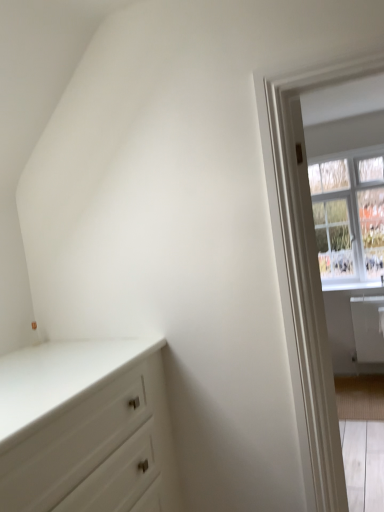
The height and width of the screenshot is (512, 384). Identify the location of white glossy chest of drawers at lower left. (86, 428).

At what (x,y) coordinates should I click in order to perform the action: click on clear glass window at upper right. Please return your answer as a coordinate pair (x, y). Looking at the image, I should click on (349, 216).

This screenshot has width=384, height=512. What do you see at coordinates (351, 286) in the screenshot?
I see `white glossy window sill at right` at bounding box center [351, 286].

Image resolution: width=384 pixels, height=512 pixels. I want to click on white glossy chest of drawers at lower left, so click(x=86, y=428).

Looking at this image, considering the sizes of objects clear glass window at upper right and white glossy window sill at right in the image provided, who is bigger, clear glass window at upper right or white glossy window sill at right?

Bigger between the two is clear glass window at upper right.

Consider the image. Considering the relative positions of clear glass window at upper right and white glossy window sill at right in the image provided, is clear glass window at upper right to the left or to the right of white glossy window sill at right?

From the image, it's evident that clear glass window at upper right is to the left of white glossy window sill at right.

Is clear glass window at upper right inside the boundaries of white glossy window sill at right, or outside?

clear glass window at upper right is not enclosed by white glossy window sill at right.

Which is in front, clear glass window at upper right or white glossy window sill at right?

clear glass window at upper right is in front.

From the picture: Which of these two, white glossy chest of drawers at lower left or white wooden door at right, is smaller?

With smaller size is white wooden door at right.

Consider the image. Is white glossy chest of drawers at lower left next to white wooden door at right?

There is a gap between white glossy chest of drawers at lower left and white wooden door at right.

Is white glossy chest of drawers at lower left completely or partially outside of white wooden door at right?

white glossy chest of drawers at lower left is positioned outside white wooden door at right.

From the image's perspective, would you say white wooden door at right is positioned over white glossy window sill at right?

No.

Which is in front, white wooden door at right or white glossy window sill at right?

white wooden door at right is more forward.

Considering the sizes of objects white wooden door at right and white glossy window sill at right in the image provided, who is wider, white wooden door at right or white glossy window sill at right?

With larger width is white glossy window sill at right.

Is white wooden door at right to the right of white glossy window sill at right from the viewer's perspective?

In fact, white wooden door at right is to the left of white glossy window sill at right.

Is white glossy window sill at right next to white glossy chest of drawers at lower left?

No, white glossy window sill at right is not next to white glossy chest of drawers at lower left.

From a real-world perspective, relative to white glossy chest of drawers at lower left, is white glossy window sill at right vertically above or below?

From a real-world perspective, white glossy window sill at right is physically above white glossy chest of drawers at lower left.

Is white glossy window sill at right to the left or to the right of white glossy chest of drawers at lower left in the image?

white glossy window sill at right is positioned on white glossy chest of drawers at lower left's right side.

Between white glossy window sill at right and clear glass window at upper right, which one has less height?

white glossy window sill at right.

Considering the sizes of objects white glossy window sill at right and clear glass window at upper right in the image provided, who is smaller, white glossy window sill at right or clear glass window at upper right?

With smaller size is white glossy window sill at right.

Looking at their sizes, would you say white glossy window sill at right is wider or thinner than clear glass window at upper right?

Considering their sizes, white glossy window sill at right looks slimmer than clear glass window at upper right.

Is the position of white glossy window sill at right more distant than that of clear glass window at upper right?

Yes, white glossy window sill at right is further from the viewer.

Is point (100, 437) farther from viewer compared to point (329, 216)?

No, it is in front of (329, 216).

Is clear glass window at upper right inside white glossy chest of drawers at lower left?

No, clear glass window at upper right is not a part of white glossy chest of drawers at lower left.

Looking at this image, is white wooden door at right facing towards white glossy chest of drawers at lower left?

No, white wooden door at right is not aimed at white glossy chest of drawers at lower left.

Between white wooden door at right and white glossy chest of drawers at lower left, which one has larger size?

Bigger between the two is white glossy chest of drawers at lower left.

Can you confirm if white wooden door at right is shorter than white glossy chest of drawers at lower left?

No.

Considering the sizes of objects white wooden door at right and white glossy chest of drawers at lower left in the image provided, who is wider, white wooden door at right or white glossy chest of drawers at lower left?

Wider between the two is white glossy chest of drawers at lower left.

At what (x,y) coordinates should I click in order to perform the action: click on window above the white glossy window sill at right (from a real-world perspective). Please return your answer as a coordinate pair (x, y). Looking at the image, I should click on (349, 216).

Where is `chest of drawers in front of the white wooden door at right`? chest of drawers in front of the white wooden door at right is located at coordinates click(86, 428).

Estimate the real-world distances between objects in this image. Which object is further from white glossy chest of drawers at lower left, clear glass window at upper right or white glossy window sill at right?

The object further to white glossy chest of drawers at lower left is clear glass window at upper right.

From the image, which object appears to be nearer to white wooden door at right, white glossy window sill at right or clear glass window at upper right?

white glossy window sill at right lies closer to white wooden door at right than the other object.

Which object lies further to the anchor point white wooden door at right, white glossy window sill at right or white glossy chest of drawers at lower left?

white glossy window sill at right is positioned further to the anchor white wooden door at right.

From the image, which object appears to be farther from white wooden door at right, clear glass window at upper right or white glossy window sill at right?

The object further to white wooden door at right is clear glass window at upper right.

Estimate the real-world distances between objects in this image. Which object is further from white glossy chest of drawers at lower left, white glossy window sill at right or white wooden door at right?

Among the two, white glossy window sill at right is located further to white glossy chest of drawers at lower left.

Based on their spatial positions, is clear glass window at upper right or white glossy chest of drawers at lower left further from white glossy window sill at right?

white glossy chest of drawers at lower left is further to white glossy window sill at right.

When comparing their distances from white glossy window sill at right, does white wooden door at right or white glossy chest of drawers at lower left seem further?

Based on the image, white glossy chest of drawers at lower left appears to be further to white glossy window sill at right.

Based on their spatial positions, is white glossy window sill at right or white glossy chest of drawers at lower left closer to clear glass window at upper right?

white glossy window sill at right.

Image resolution: width=384 pixels, height=512 pixels. I want to click on window located between white glossy chest of drawers at lower left and white glossy window sill at right in the depth direction, so pyautogui.click(x=349, y=216).

This screenshot has width=384, height=512. Identify the location of window located between white wooden door at right and white glossy window sill at right in the depth direction. (349, 216).

Locate an element on the screen. This screenshot has width=384, height=512. door between white glossy chest of drawers at lower left and white glossy window sill at right along the z-axis is located at coordinates (314, 302).

Find the location of a particular element. door between white glossy chest of drawers at lower left and clear glass window at upper right in the front-back direction is located at coordinates (314, 302).